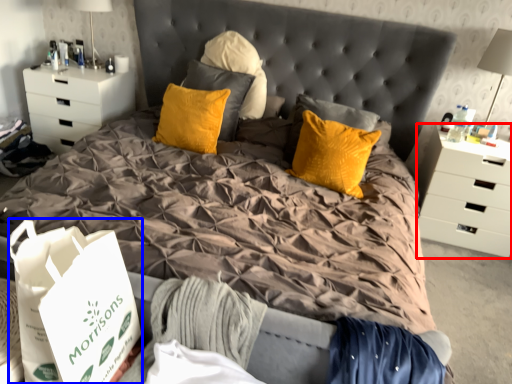
Question: Which of the following is the closest to the observer, chest of drawers (highlighted by a red box) or shopping bag (highlighted by a blue box)?

Choices:
 (A) chest of drawers
 (B) shopping bag

Answer: (B)